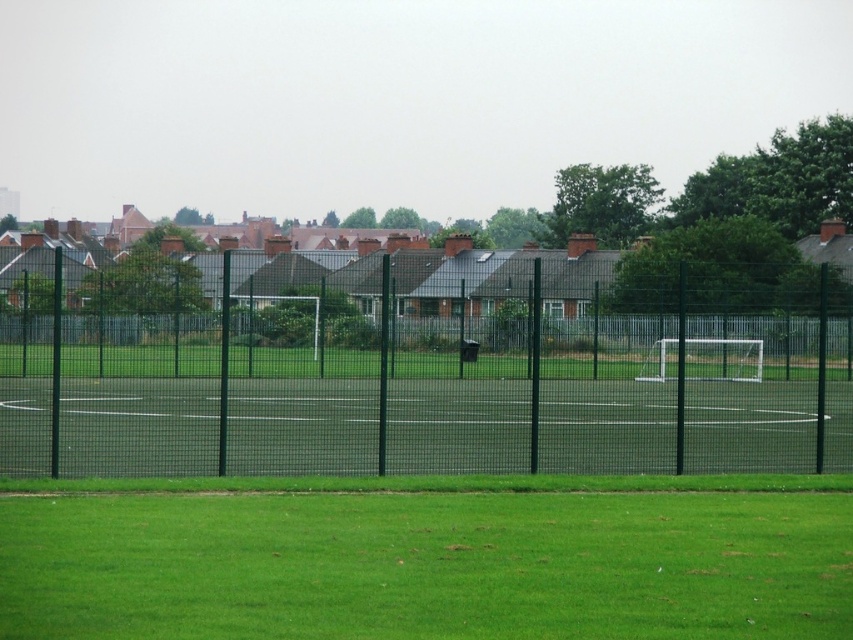
You are standing at the entrance of the sports field and want to reach the green mesh fence at center. According to the field layout, in which direction should you walk to reach it?

The green mesh fence at center is located at point coordinates, so you should walk towards the center of the field to reach it.

You are standing at the point marked by the coordinates (422, 365) on the soccer field. What object are you closest to?

You are closest to the green mesh fence at center, as the point (422, 365) represents its location.

You are a landscape architect designing a new sports field. You need to ensure that the green mesh fence at center and the green grass at lower center meet specific spatial requirements. Which of these two elements has a greater width according to the provided description?

The green mesh fence at center has a larger width than the green grass at lower center based on the description provided.